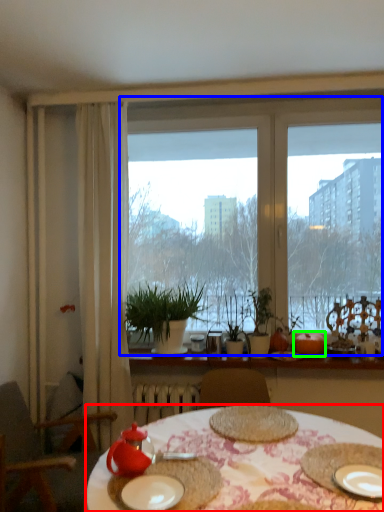
Question: Which object is positioned farthest from desk (highlighted by a red box)? Select from window (highlighted by a blue box) and fruit (highlighted by a green box).

Choices:
 (A) window
 (B) fruit

Answer: (A)